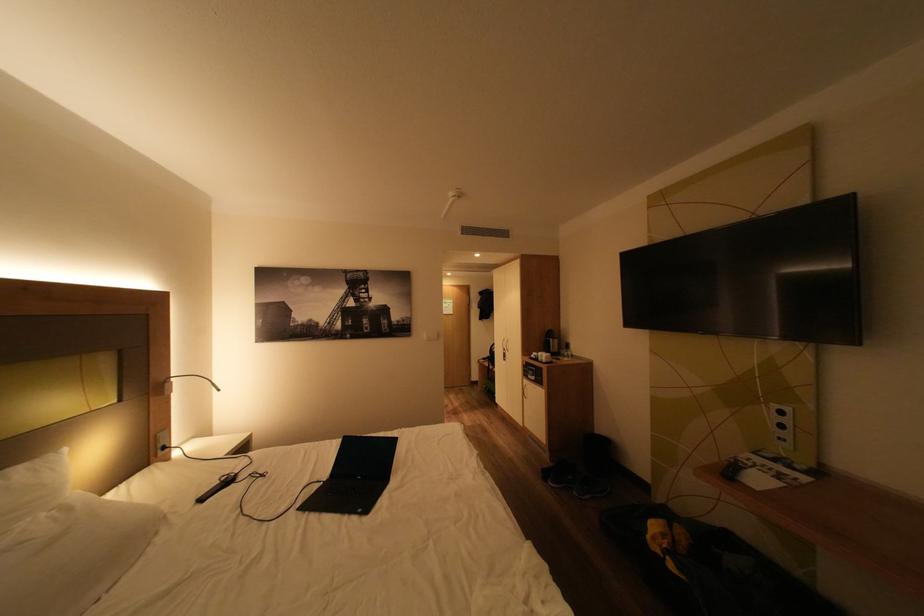
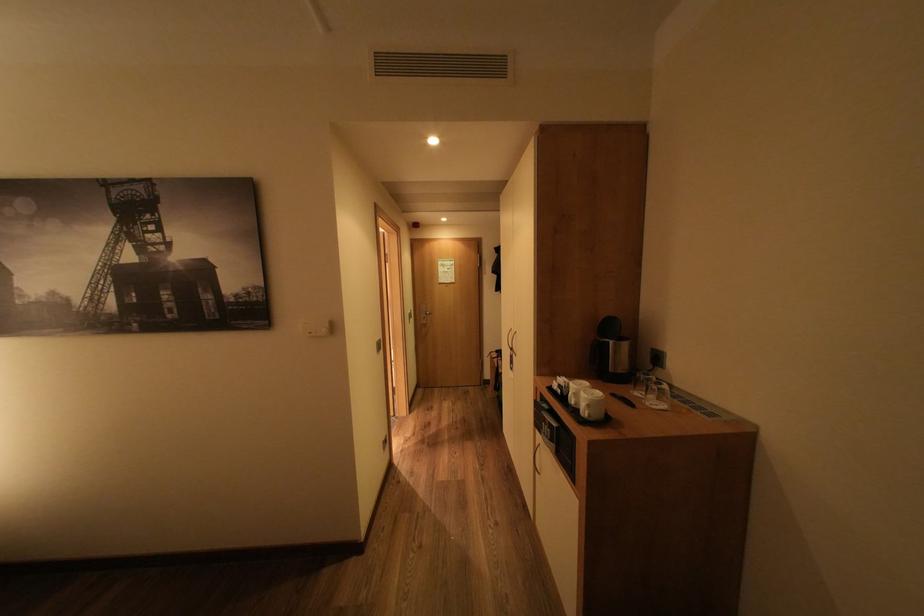
Where in the second image is the point corresponding to (x=564, y=359) from the first image?

(624, 395)